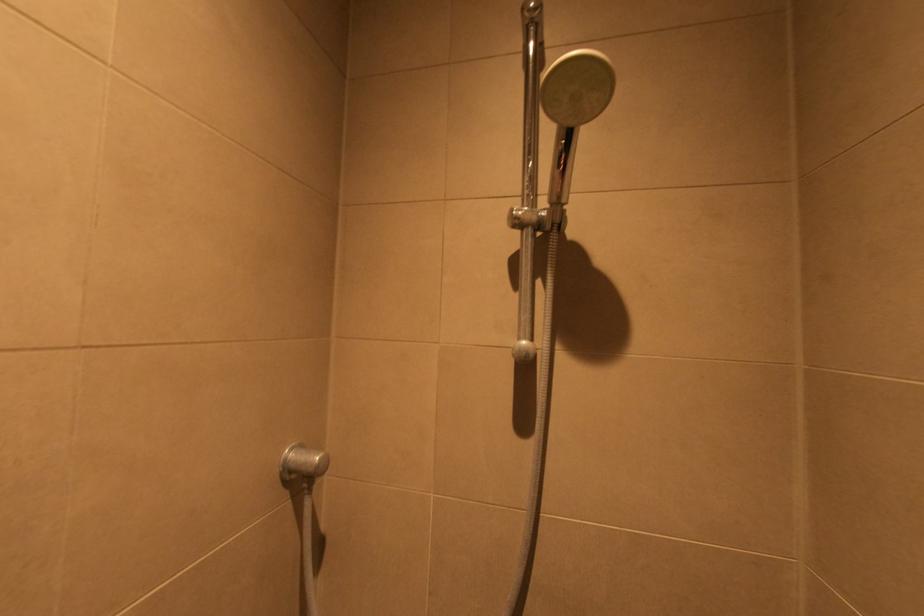
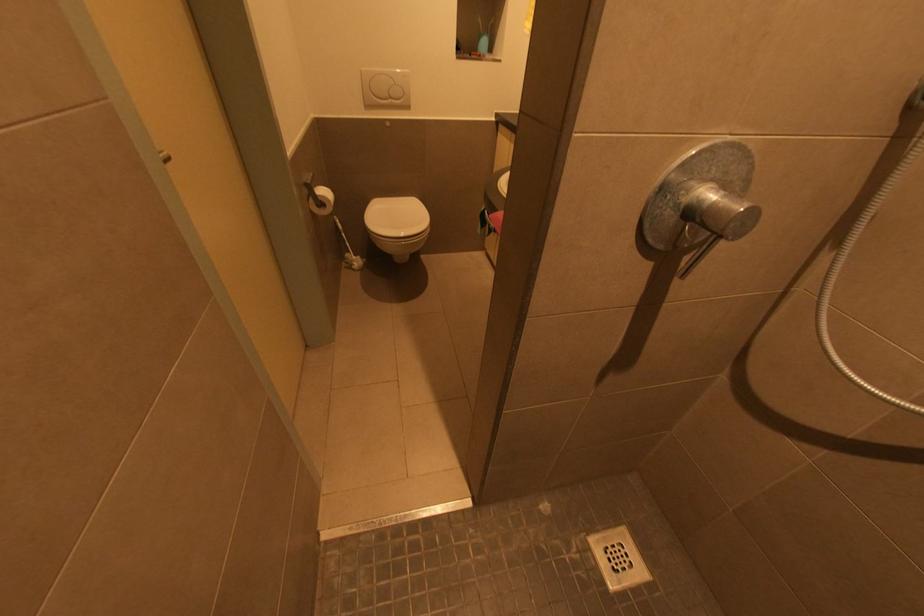
How did the camera likely rotate?

The camera rotated toward left-down.